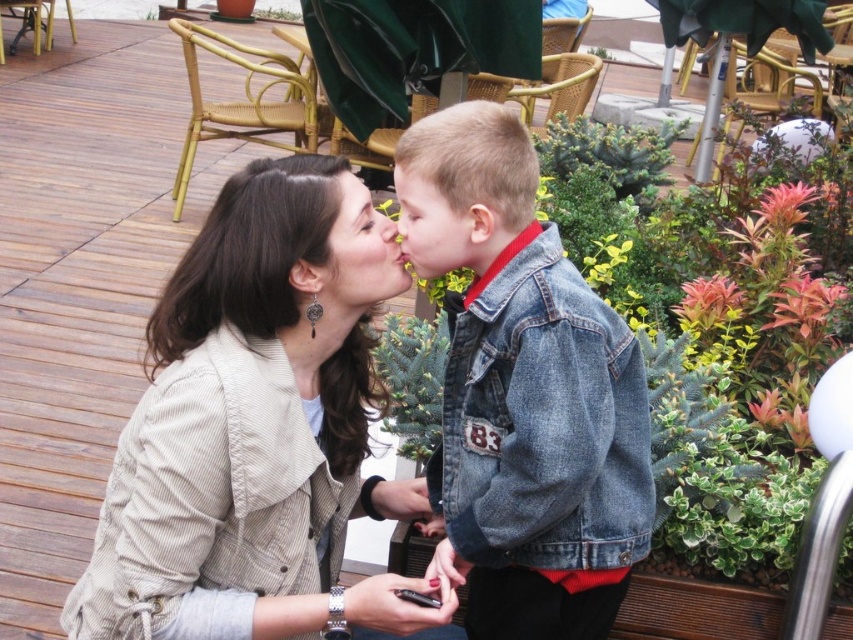
Does denim jacket at center have a smaller size compared to matte skin at center?

No.

From the picture: Can you confirm if denim jacket at center is positioned below matte skin at center?

Indeed, denim jacket at center is positioned under matte skin at center.

Who is more distant from viewer, (491,440) or (381,236)?

Positioned behind is point (381,236).

Find the location of a particular element. Image resolution: width=853 pixels, height=640 pixels. denim jacket at center is located at coordinates (523, 392).

Does denim jacket at center lie in front of smooth skin face at center?

Yes, denim jacket at center is in front of smooth skin face at center.

From the picture: Between denim jacket at center and smooth skin face at center, which one has less height?

Standing shorter between the two is smooth skin face at center.

At what (x,y) coordinates should I click in order to perform the action: click on denim jacket at center. Please return your answer as a coordinate pair (x, y). The width and height of the screenshot is (853, 640). Looking at the image, I should click on (523, 392).

Identify the location of denim jacket at center. (523, 392).

Who is shorter, beige corduroy jacket at center or smooth skin face at center?

smooth skin face at center

Measure the distance between beige corduroy jacket at center and camera.

beige corduroy jacket at center and camera are 5.33 feet apart from each other.

Who is more distant from viewer, (x=228, y=426) or (x=416, y=205)?

Positioned behind is point (x=416, y=205).

Find the location of a particular element. beige corduroy jacket at center is located at coordinates (248, 419).